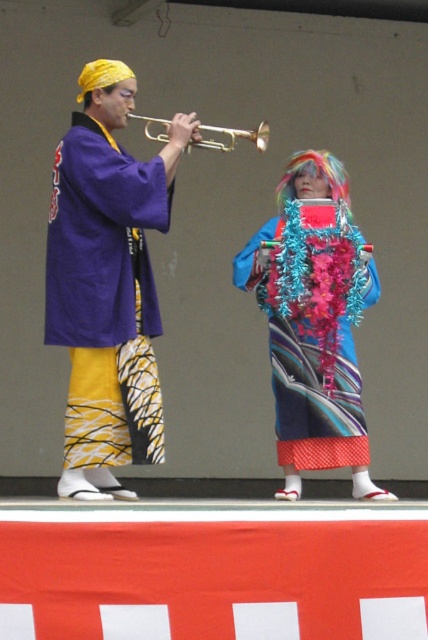
Based on the photo, is shiny blue kimono at center wider than brass trumpet at center?

Correct, the width of shiny blue kimono at center exceeds that of brass trumpet at center.

Can you confirm if shiny blue kimono at center is positioned to the left of brass trumpet at center?

No, shiny blue kimono at center is not to the left of brass trumpet at center.

You are a GUI agent. You are given a task and a screenshot of the screen. Output one action in this format:
    pyautogui.click(x=<x>, y=<y>)
    Task: Click on the shiny blue kimono at center
    This screenshot has height=640, width=428.
    Given the screenshot: What is the action you would take?
    pyautogui.click(x=314, y=321)

The image size is (428, 640). Find the location of `shiny blue kimono at center`. shiny blue kimono at center is located at coordinates (314, 321).

Is purple silk kimono at left taller than brass trumpet at center?

Correct, purple silk kimono at left is much taller as brass trumpet at center.

Does purple silk kimono at left have a smaller size compared to brass trumpet at center?

Actually, purple silk kimono at left might be larger than brass trumpet at center.

The image size is (428, 640). I want to click on purple silk kimono at left, so click(106, 296).

Does purple silk kimono at left have a lesser width compared to shiny blue kimono at center?

Correct, purple silk kimono at left's width is less than shiny blue kimono at center's.

Is purple silk kimono at left wider than shiny blue kimono at center?

In fact, purple silk kimono at left might be narrower than shiny blue kimono at center.

In order to click on purple silk kimono at left in this screenshot , I will do `click(106, 296)`.